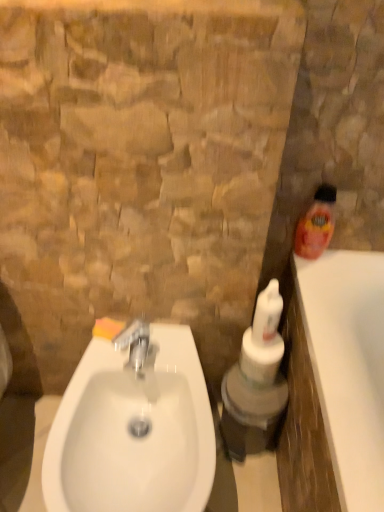
I want to click on empty space that is to the right of silver metallic faucet at center, so click(x=183, y=364).